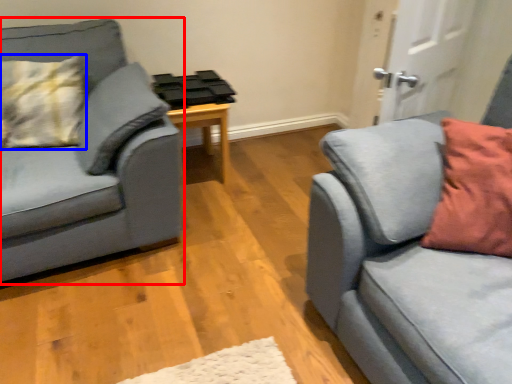
Question: Which point is further to the camera, studio couch (highlighted by a red box) or pillow (highlighted by a blue box)?

Choices:
 (A) studio couch
 (B) pillow

Answer: (B)